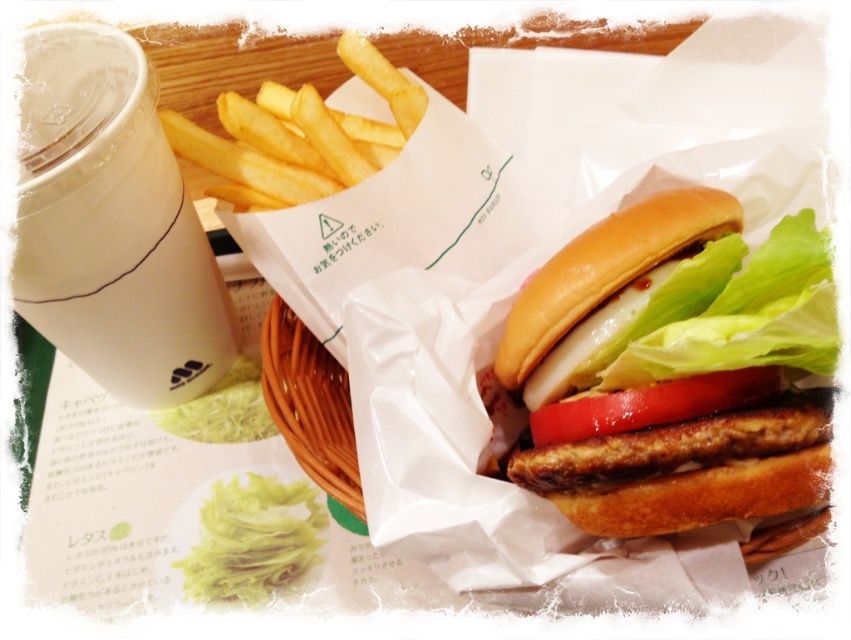
You are a food delivery person who needs to place a golden brown bun at center and a brown woven basket at center into a rectangular box that is 12 inches long. Can both items fit side by side without overlapping?

The distance between the golden brown bun at center and brown woven basket at center is 12.12 inches. Since the box is only 12 inches long, the items cannot fit side by side without overlapping.

You are a customer at a diner and want to place your burger on the table. The burger is currently on the golden brown bun at center. There is also a brown woven basket at center on the table. Can you place the burger on the table without moving the basket?

The golden brown bun at center is in front of the brown woven basket at center, so you can place the burger on the table behind the basket.